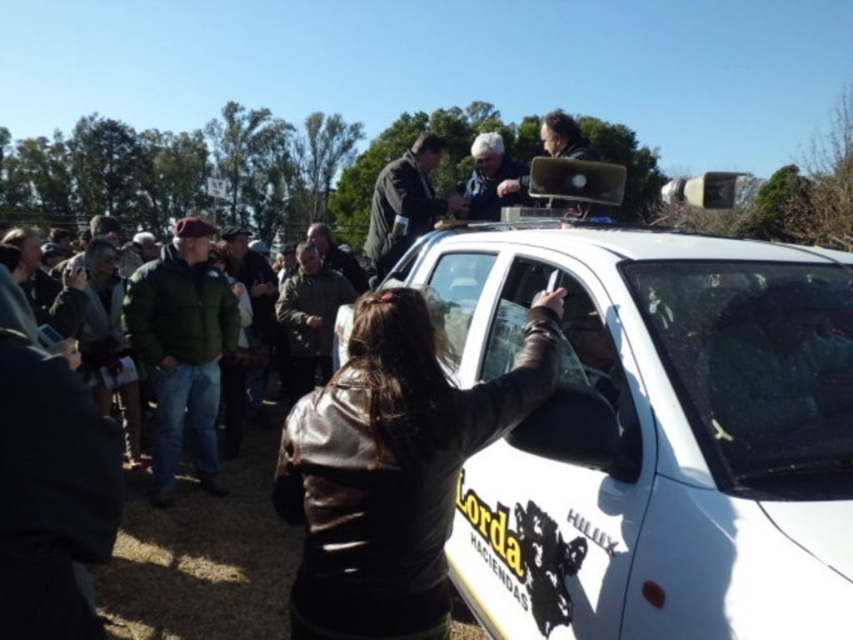
Does green fuzzy jacket at lower left appear under green fuzzy jacket at left?

Yes, green fuzzy jacket at lower left is below green fuzzy jacket at left.

In the scene shown: Does green fuzzy jacket at lower left have a greater width compared to green fuzzy jacket at left?

Yes.

Who is more distant from viewer, (331,337) or (206,477)?

The point (331,337) is behind.

Find the location of a particular element. The height and width of the screenshot is (640, 853). green fuzzy jacket at lower left is located at coordinates (184, 349).

Is green fuzzy jacket at lower left wider than dark brown leather jacket at upper center?

No, green fuzzy jacket at lower left is not wider than dark brown leather jacket at upper center.

Identify the location of green fuzzy jacket at lower left. (184, 349).

The height and width of the screenshot is (640, 853). I want to click on green fuzzy jacket at lower left, so click(x=184, y=349).

Can you confirm if white matte car at center is smaller than matte black laptop at upper center?

Incorrect, white matte car at center is not smaller in size than matte black laptop at upper center.

Who is more distant from viewer, (833, 536) or (505, 172)?

Point (505, 172)

Where is `white matte car at center`? The width and height of the screenshot is (853, 640). white matte car at center is located at coordinates (654, 433).